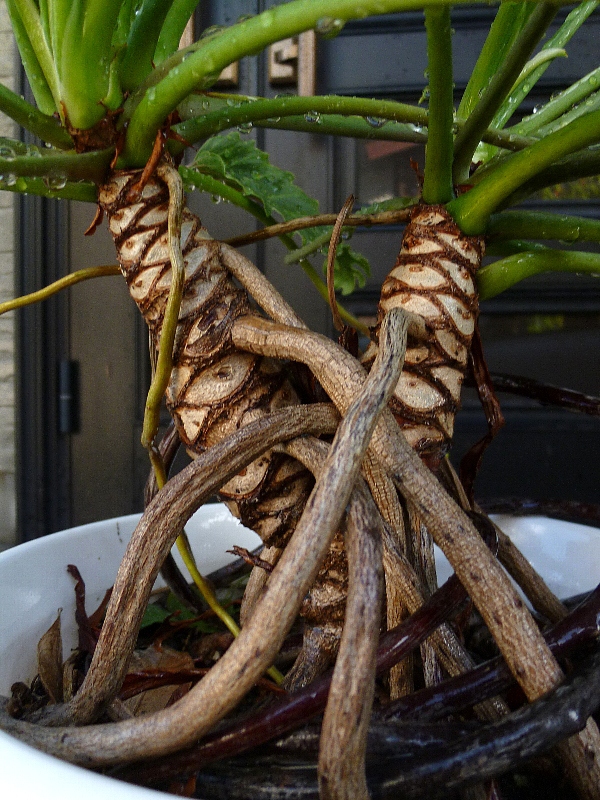
The image size is (600, 800). What are the coordinates of `pot` in the screenshot? It's located at (20, 584).